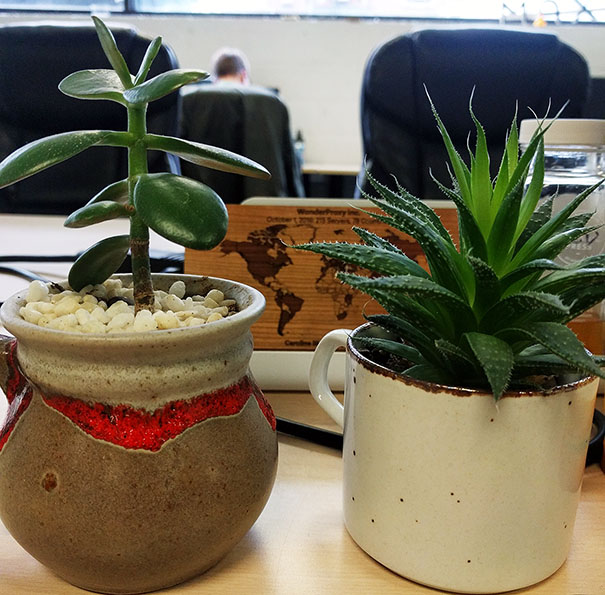
Where is `plant`? The width and height of the screenshot is (605, 595). plant is located at coordinates (169, 198), (446, 300).